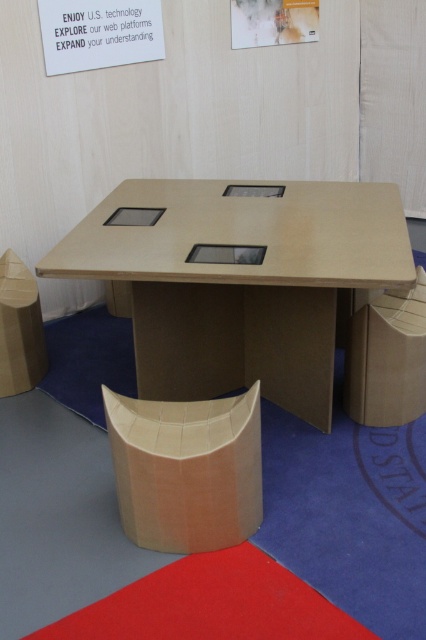
Who is positioned more to the right, matte cardboard box at center or matte cardboard box at left?

matte cardboard box at center

Does matte cardboard box at center have a greater width compared to matte cardboard box at left?

Indeed, matte cardboard box at center has a greater width compared to matte cardboard box at left.

Describe the element at coordinates (187, 468) in the screenshot. The height and width of the screenshot is (640, 426). I see `matte cardboard box at center` at that location.

I want to click on matte cardboard box at center, so click(187, 468).

Is matte cardboard box at right bigger than matte cardboard box at left?

Correct, matte cardboard box at right is larger in size than matte cardboard box at left.

Does matte cardboard box at right appear under matte cardboard box at left?

Indeed, matte cardboard box at right is positioned under matte cardboard box at left.

I want to click on matte cardboard box at right, so click(x=388, y=356).

Locate an element on the screen. matte cardboard table at center is located at coordinates (238, 280).

Who is taller, matte cardboard table at center or white paper at upper center?

With more height is matte cardboard table at center.

What do you see at coordinates (238, 280) in the screenshot? The height and width of the screenshot is (640, 426). I see `matte cardboard table at center` at bounding box center [238, 280].

Identify the location of matte cardboard table at center. This screenshot has width=426, height=640. (238, 280).